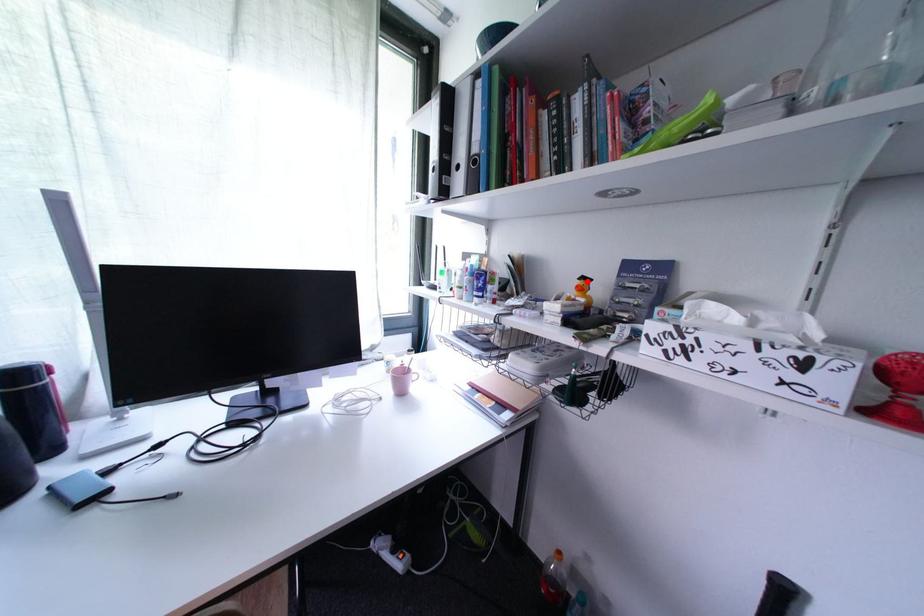
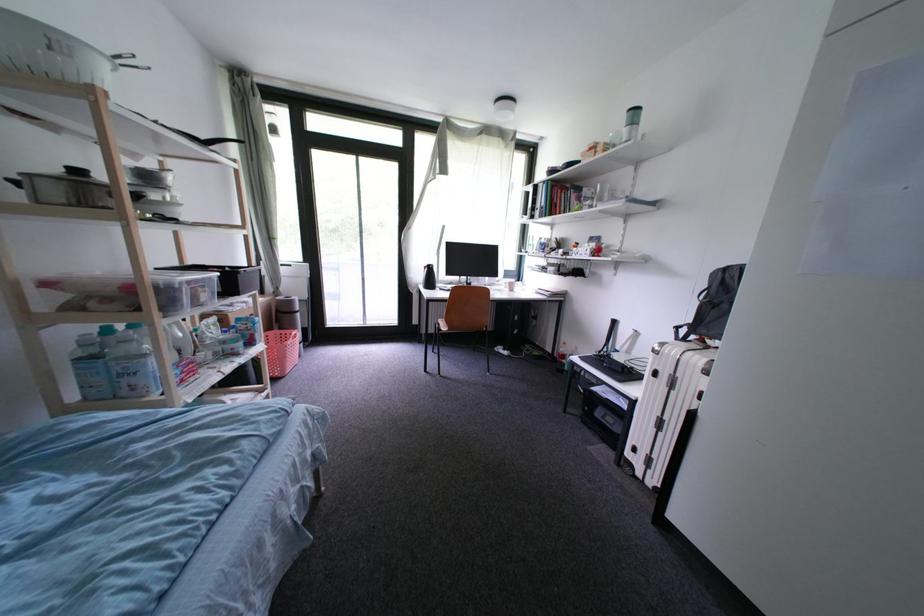
Question: I am providing you with two images of the same scene from different viewpoints. A red point is marked on the first image. Can you still see the location of the red point in image 2?

Choices:
 (A) Yes
 (B) No

Answer: (B)